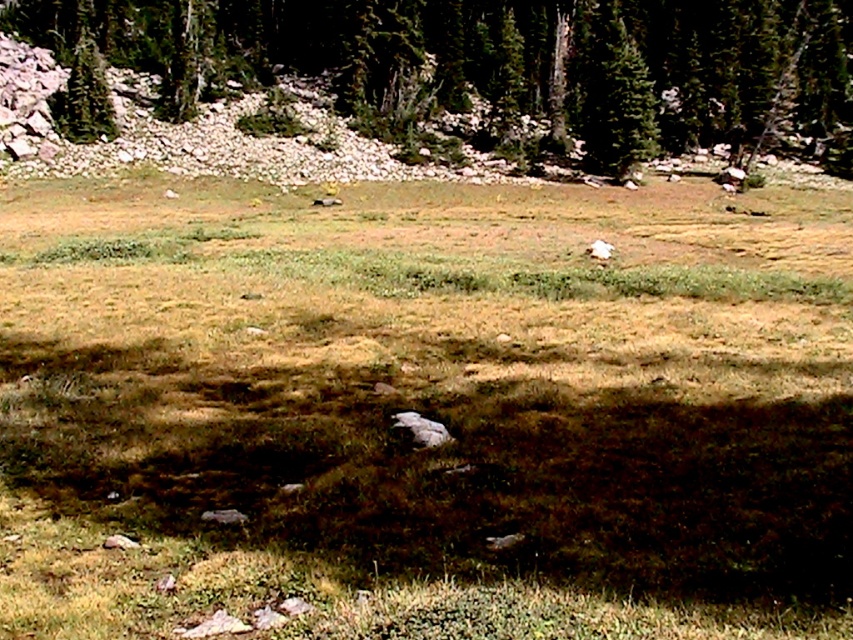
You are a hiker standing at the base of the green textured pine tree at upper center. You want to take a photo of the tree with your smartphone camera, which has a maximum zoom range of 10 meters. Can you capture the entire tree in one shot without moving closer or farther away?

The green textured pine tree at upper center is 69.16 meters away from the viewer. Since the smartphone camera has a maximum zoom range of 10 meters, the tree is too far away to be captured in full without moving closer.

You are a hiker trying to navigate through the grassy field. You see the green grass at center and the green matte tree at upper left. Which direction should you walk to move away from the tree?

You should walk to the right of the green matte tree at upper left because the green grass at center is located to the right of it, indicating that moving in that direction would take you away from the tree.

You are standing in a mountainous area and want to take a photo of the green textured pine tree at upper center. Which direction should you face to ensure the tree is centered in your camera view?

The green textured pine tree at upper center is located at coordinates 0.150 on the x and 0.720 on the y axis. To center it in your camera view, you should aim your camera slightly to the left and upwards since the tree is positioned towards the upper left quadrant of the image.